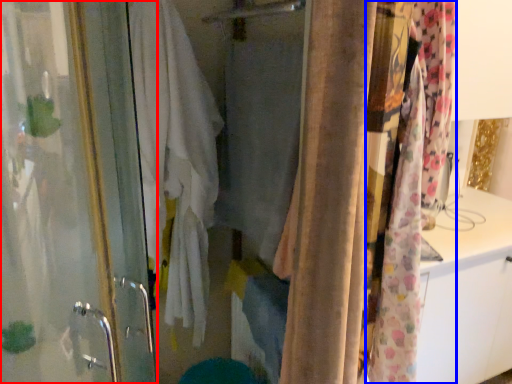
Question: Which object is further to the camera taking this photo, screen door (highlighted by a red box) or curtain (highlighted by a blue box)?

Choices:
 (A) screen door
 (B) curtain

Answer: (B)